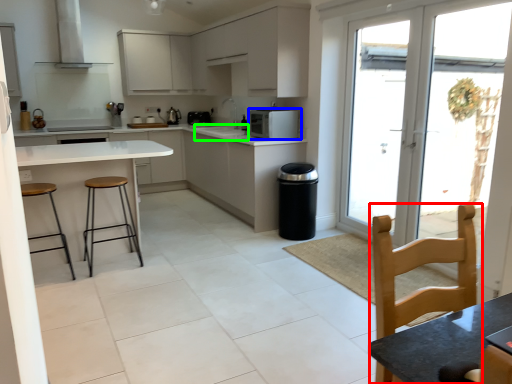
Question: Estimate the real-world distances between objects in this image. Which object is farther from chair (highlighted by a red box), kitchen appliance (highlighted by a blue box) or sink (highlighted by a green box)?

Choices:
 (A) kitchen appliance
 (B) sink

Answer: (B)